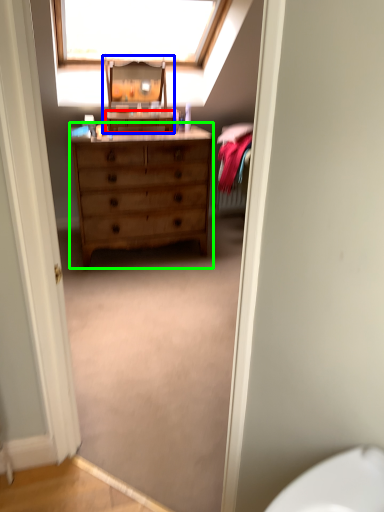
Question: Which is nearer to the cabinetry (highlighted by a red box)? changing table (highlighted by a blue box) or chest of drawers (highlighted by a green box).

Choices:
 (A) changing table
 (B) chest of drawers

Answer: (A)